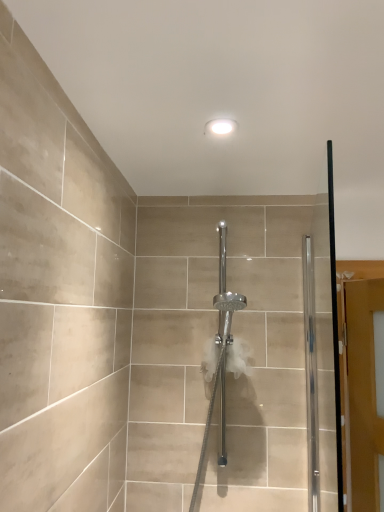
Image resolution: width=384 pixels, height=512 pixels. Describe the element at coordinates (220, 127) in the screenshot. I see `white glossy light fixture at upper center` at that location.

Measure the distance between white glossy light fixture at upper center and camera.

white glossy light fixture at upper center and camera are 1.05 meters apart from each other.

Where is `white glossy light fixture at upper center`? The height and width of the screenshot is (512, 384). white glossy light fixture at upper center is located at coordinates (220, 127).

Where is `white glossy light fixture at upper center`? The height and width of the screenshot is (512, 384). white glossy light fixture at upper center is located at coordinates (220, 127).